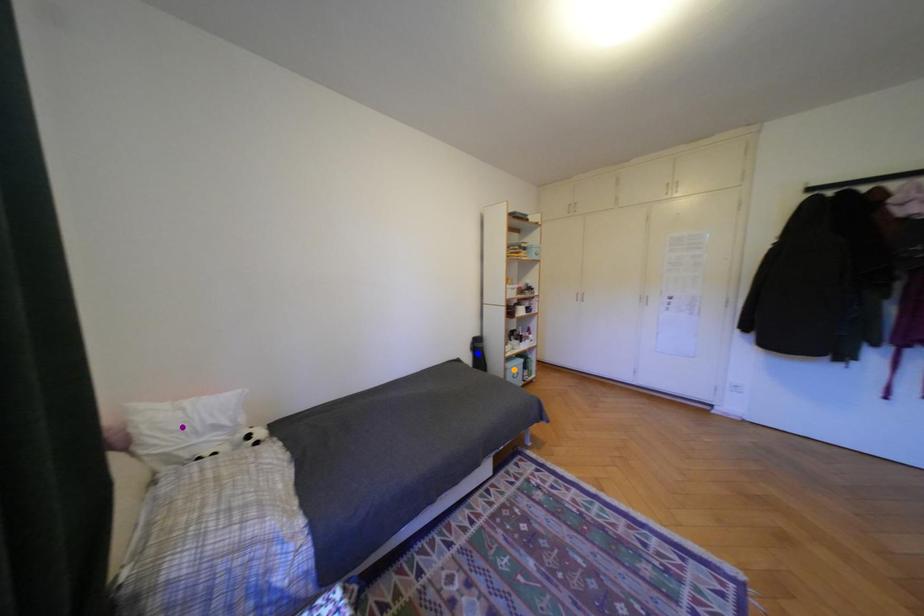
Order these from nearest to farthest:
purple point, blue point, orange point

purple point < orange point < blue point